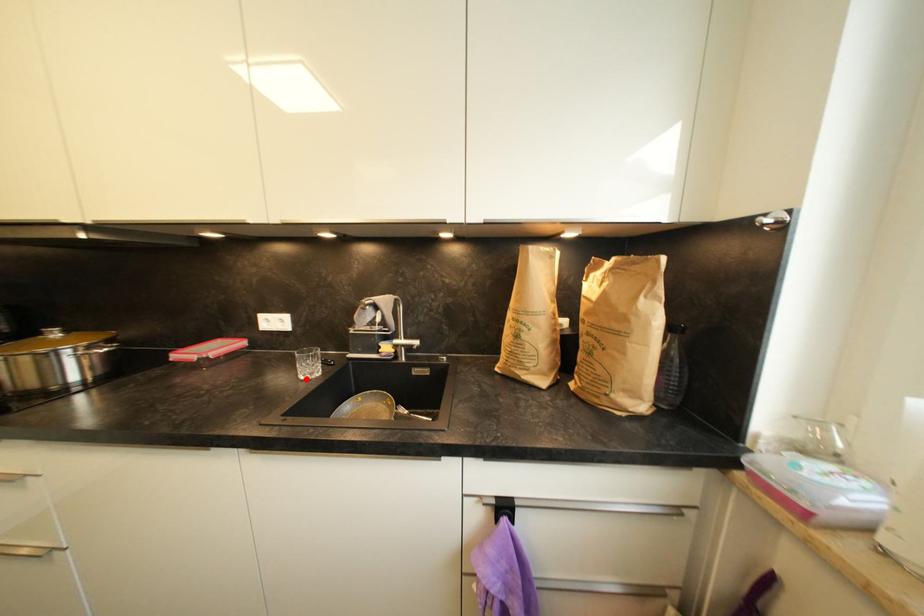
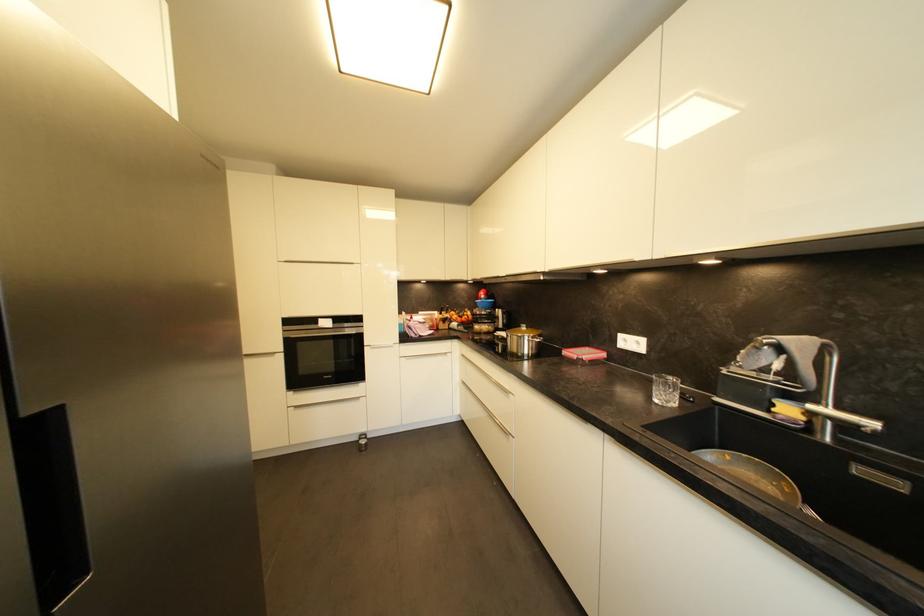
Where in the second image is the point corresponding to the highlighted location from the first image?

(661, 403)